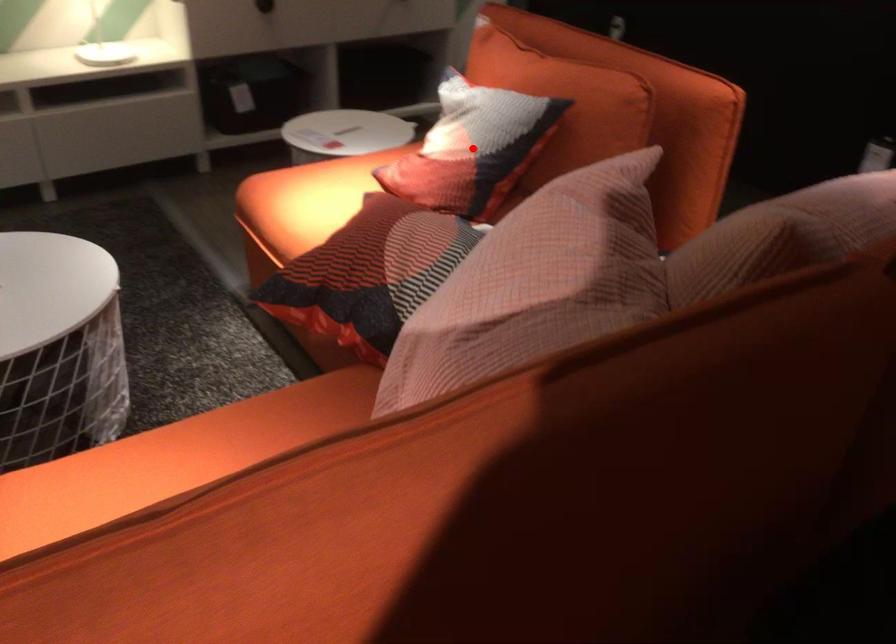
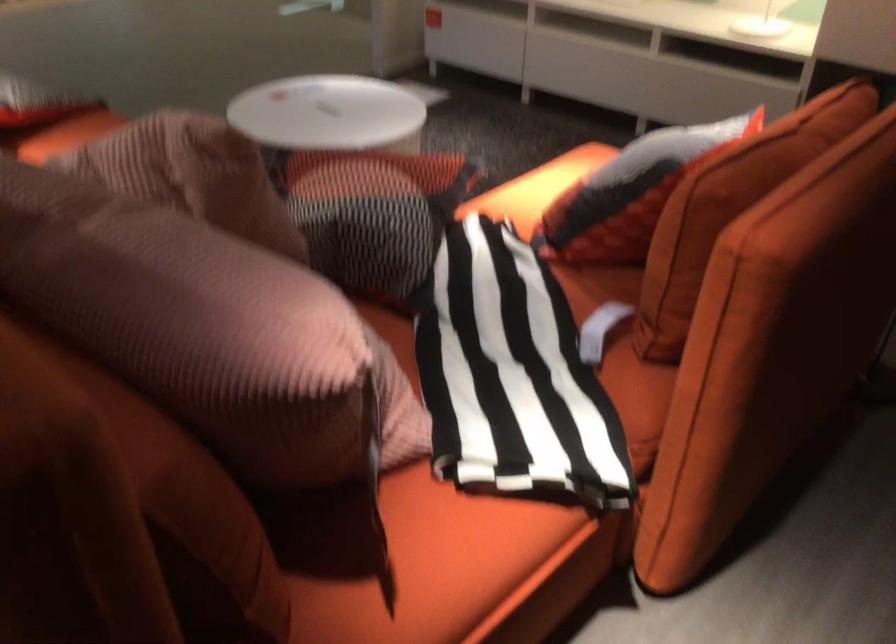
Question: I am providing you with two images of the same scene from different viewpoints. A red point is marked on the first image. At the location where the point appears in image 1, is it still visible in image 2?

Choices:
 (A) Yes
 (B) No

Answer: (B)